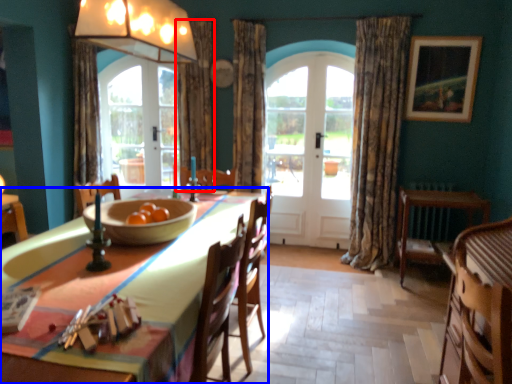
Question: Which object appears farthest to the camera in this image, curtain (highlighted by a red box) or table (highlighted by a blue box)?

Choices:
 (A) curtain
 (B) table

Answer: (A)